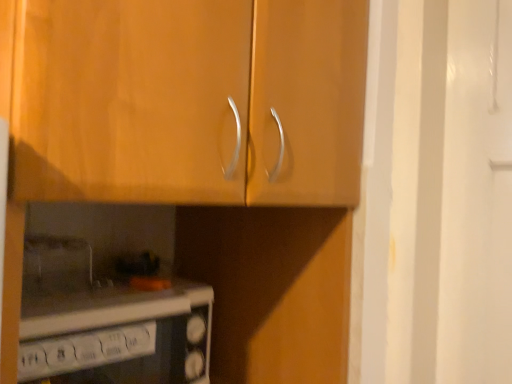
Question: From the image's perspective, is wooden cabinet at upper center on top of white glossy microwave at lower left?

Choices:
 (A) yes
 (B) no

Answer: (A)

Question: Considering the relative sizes of wooden cabinet at upper center and white glossy microwave at lower left in the image provided, is wooden cabinet at upper center smaller than white glossy microwave at lower left?

Choices:
 (A) yes
 (B) no

Answer: (B)

Question: Is the depth of wooden cabinet at upper center less than that of white glossy microwave at lower left?

Choices:
 (A) no
 (B) yes

Answer: (B)

Question: Can you confirm if wooden cabinet at upper center is shorter than white glossy microwave at lower left?

Choices:
 (A) yes
 (B) no

Answer: (B)

Question: Is wooden cabinet at upper center positioned with its back to white glossy microwave at lower left?

Choices:
 (A) no
 (B) yes

Answer: (A)

Question: From the image's perspective, is wooden cabinet at upper center located beneath white glossy microwave at lower left?

Choices:
 (A) yes
 (B) no

Answer: (B)

Question: Does white glossy microwave at lower left turn towards wooden cabinet at upper center?

Choices:
 (A) yes
 (B) no

Answer: (B)

Question: Are white glossy microwave at lower left and wooden cabinet at upper center making contact?

Choices:
 (A) no
 (B) yes

Answer: (A)

Question: From the image's perspective, is white glossy microwave at lower left above wooden cabinet at upper center?

Choices:
 (A) no
 (B) yes

Answer: (A)

Question: From the image's perspective, is white glossy microwave at lower left located beneath wooden cabinet at upper center?

Choices:
 (A) no
 (B) yes

Answer: (B)

Question: Is white glossy microwave at lower left positioned in front of wooden cabinet at upper center?

Choices:
 (A) no
 (B) yes

Answer: (A)

Question: Are white glossy microwave at lower left and wooden cabinet at upper center far apart?

Choices:
 (A) no
 (B) yes

Answer: (A)

Question: Is wooden cabinet at upper center to the left or to the right of white glossy microwave at lower left in the image?

Choices:
 (A) right
 (B) left

Answer: (A)